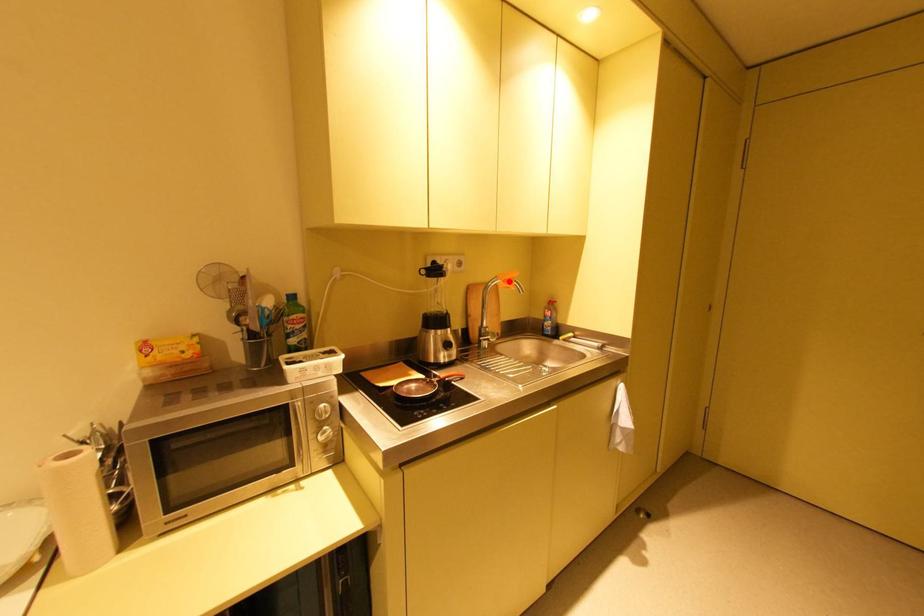
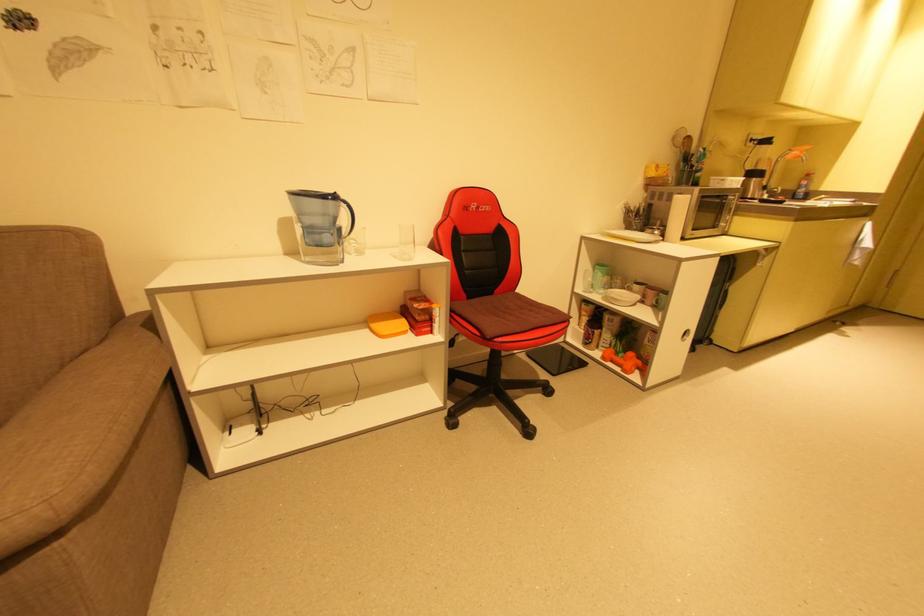
Question: I am providing you with two images of the same scene from different viewpoints. Image1 has a red point marked. In image2, the corresponding 3D location appears at what relative position? Reply with the corresponding letter.

Choices:
 (A) Closer
 (B) Farther

Answer: (B)